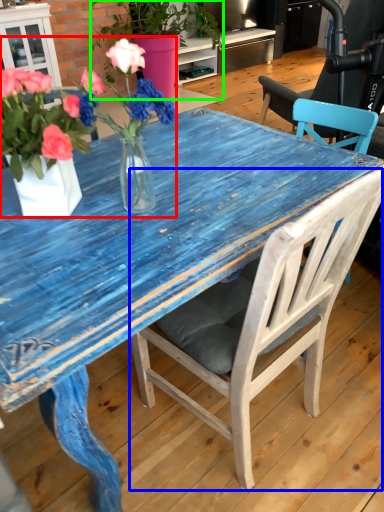
Question: Which object is positioned farthest from floral arrangement (highlighted by a red box)? Select from chair (highlighted by a blue box) and houseplant (highlighted by a green box).

Choices:
 (A) chair
 (B) houseplant

Answer: (B)